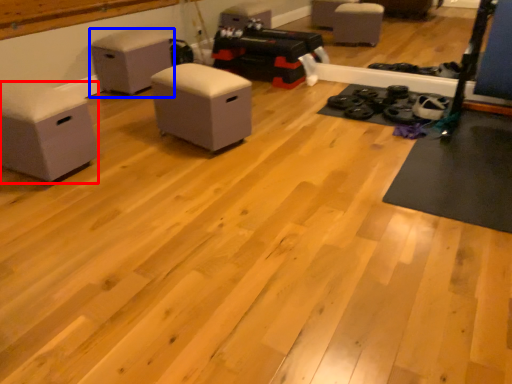
Question: Which of the following is the closest to the observer, furniture (highlighted by a red box) or furniture (highlighted by a blue box)?

Choices:
 (A) furniture
 (B) furniture

Answer: (A)